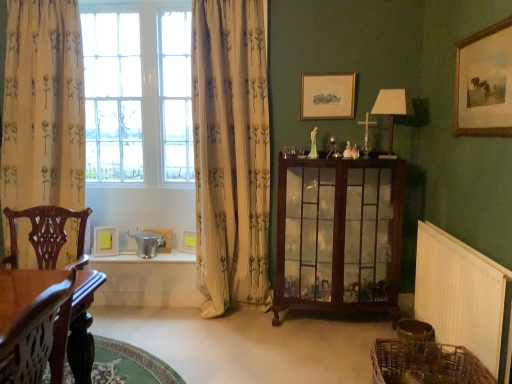
Locate an element on the screen. free space to the left of mahogany glass cabinet at center is located at coordinates (253, 337).